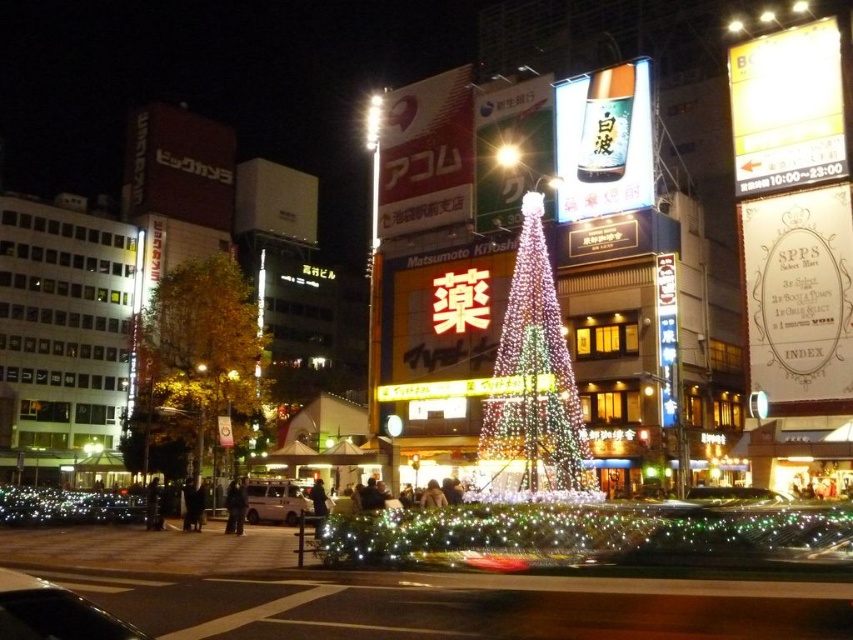
Question: Observing the image, what is the correct spatial positioning of metallic silver car at lower left in reference to shiny silver car at center?

Choices:
 (A) above
 (B) below

Answer: (B)

Question: Which object appears closest to the camera in this image?

Choices:
 (A) yellow/golden/leaves at left
 (B) white matte van at lower left
 (C) shiny silver car at center

Answer: (C)

Question: Is illuminated wireframe at center further to camera compared to white matte van at lower left?

Choices:
 (A) no
 (B) yes

Answer: (A)

Question: In this image, where is yellow/golden/leaves at left located relative to shiny black car at lower left?

Choices:
 (A) below
 (B) above

Answer: (B)

Question: Which object appears closest to the camera in this image?

Choices:
 (A) shiny silver car at center
 (B) shiny black car at lower left
 (C) yellow/golden/leaves at left
 (D) illuminated wireframe at center

Answer: (B)

Question: Among these points, which one is nearest to the camera?

Choices:
 (A) (509, 458)
 (B) (274, 506)
 (C) (55, 595)

Answer: (C)